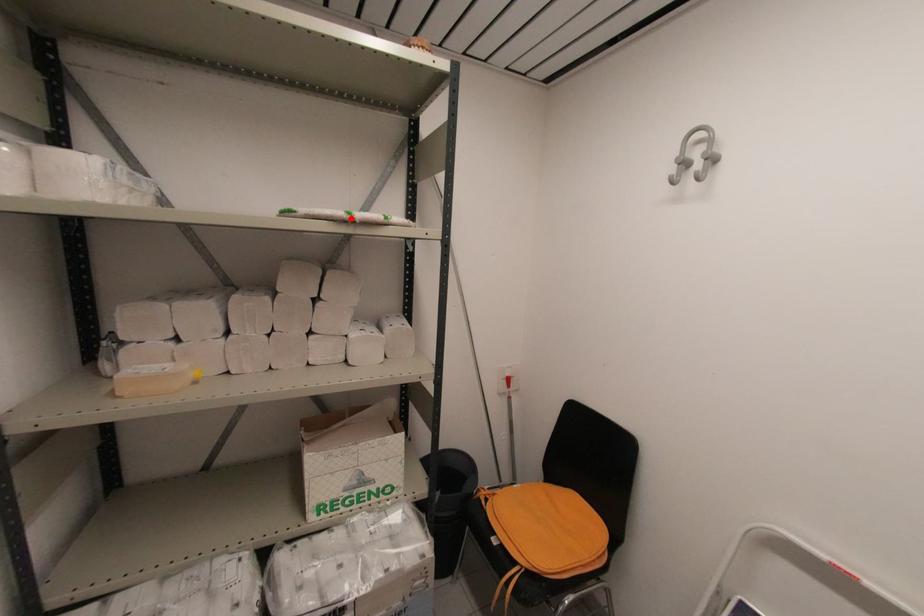
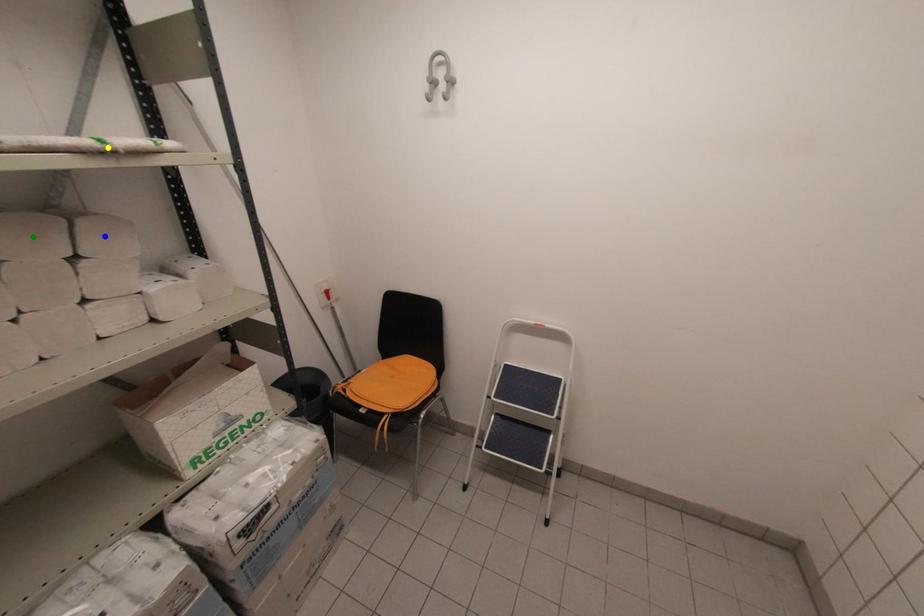
Question: I am providing you with two images of the same scene from different viewpoints. A red point is marked on the first image. You are given multiple points on the second image. Which point in image 2 represents the same 3d spot as the red point in image 1?

Choices:
 (A) blue point
 (B) green point
 (C) yellow point

Answer: (C)